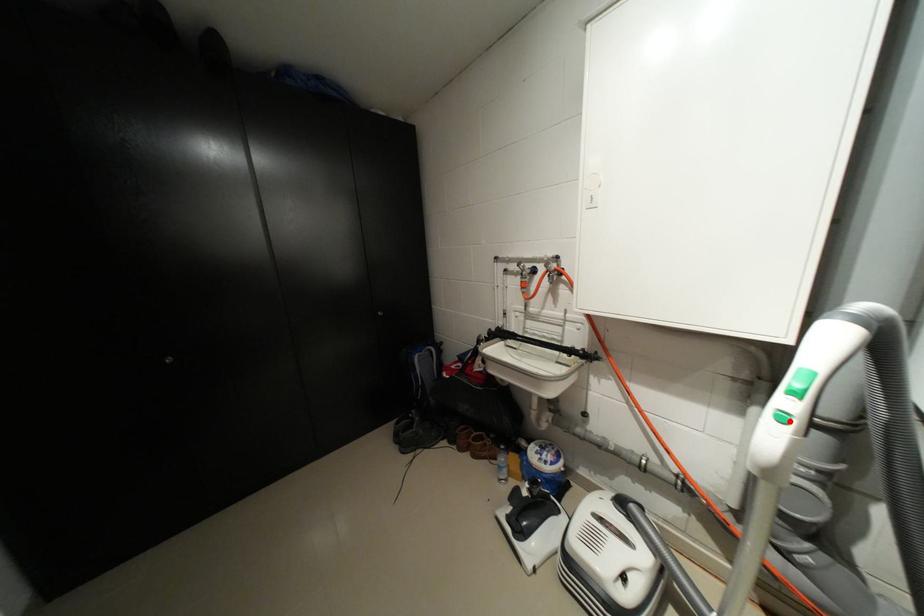
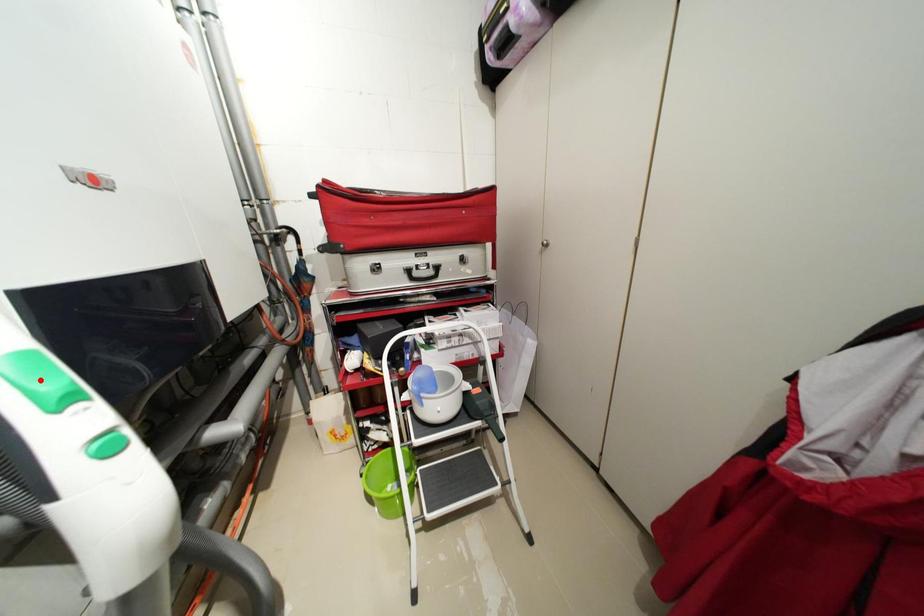
I am providing you with two images of the same scene from different viewpoints. A red point is marked on the first image and another point is marked on the second image. Does the point marked in image1 correspond to the same location as the one in image2?

No